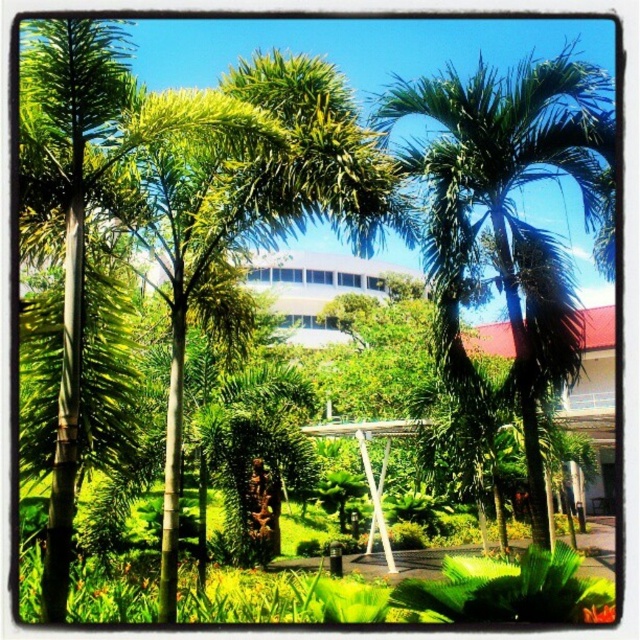
You are standing in the tropical garden and want to take a photo of the green leafy palm tree at left without the green leafy palm tree at center blocking it. What should you do?

Move to the right side of the green leafy palm tree at center so that the green leafy palm tree at left is visible behind it, since the green leafy palm tree at center is positioned over the green leafy palm tree at left.

You are planning to place a bench between the green leafy palm tree at center and the green leafy palm tree at left. Based on their widths, which palm tree would require more space for the bench to be placed comfortably?

The green leafy palm tree at center might require more space because it is wider than the green leafy palm tree at left according to the description.

You are standing in the tropical garden scene described. You notice a point marked at coordinates (x=508, y=218). Which object from the scene does this point correspond to?

The point at coordinates (x=508, y=218) corresponds to the green leafy palm tree at center.